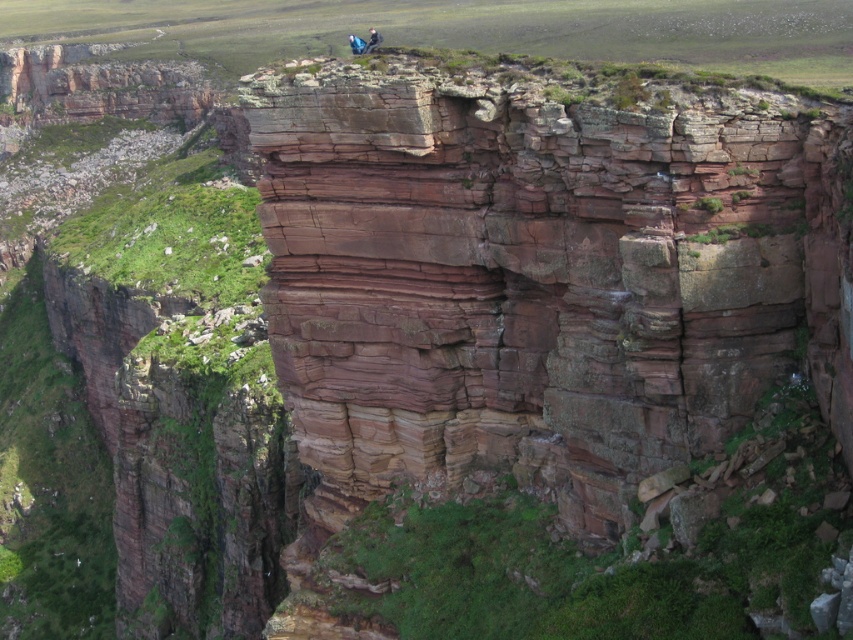
How far apart are dark blue fabric hiker at upper center and blue fabric hiker at upper center?

dark blue fabric hiker at upper center is 35.19 feet away from blue fabric hiker at upper center.

Does dark blue fabric hiker at upper center appear under blue fabric hiker at upper center?

Incorrect, dark blue fabric hiker at upper center is not positioned below blue fabric hiker at upper center.

Is point (370, 36) farther from camera compared to point (360, 40)?

Yes, it is.

Identify the location of dark blue fabric hiker at upper center. The width and height of the screenshot is (853, 640). (372, 40).